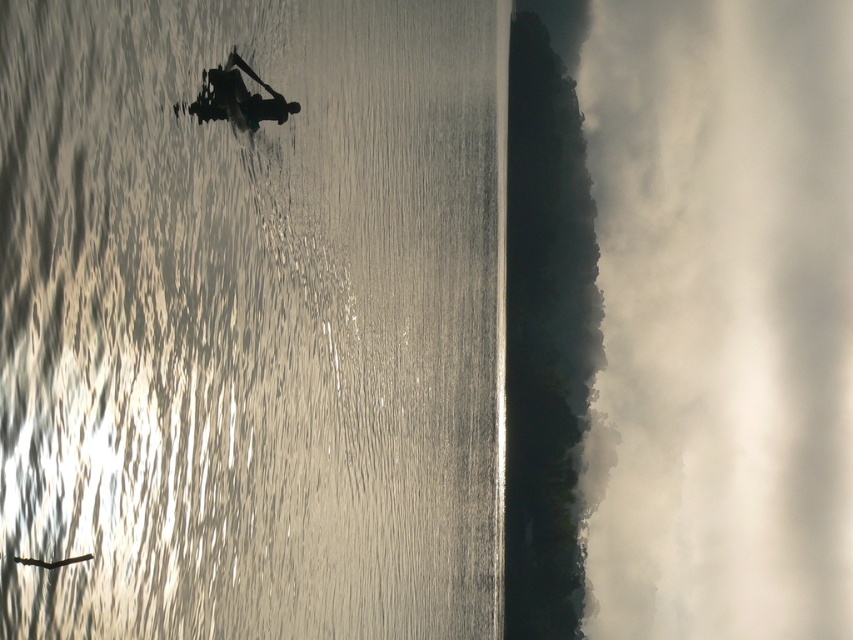
You are an observer standing on the shore looking at the reflective silver water at center and the silhouette wooden boat at upper center. Which object appears bigger in the scene?

The reflective silver water at center appears bigger than the silhouette wooden boat at upper center because it has a larger size according to the description.

You are an observer standing on the shore of the water scene. You notice the reflective silver water at center and the silhouette wooden boat at upper center. Which object appears larger in height when viewed from your position?

The reflective silver water at center appears larger in height than the silhouette wooden boat at upper center because it is taller.